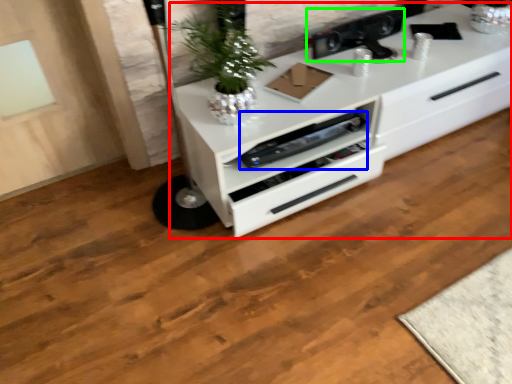
Question: Considering the real-world distances, which object is closest to chest of drawers (highlighted by a red box)? appliance (highlighted by a blue box) or appliance (highlighted by a green box).

Choices:
 (A) appliance
 (B) appliance

Answer: (A)